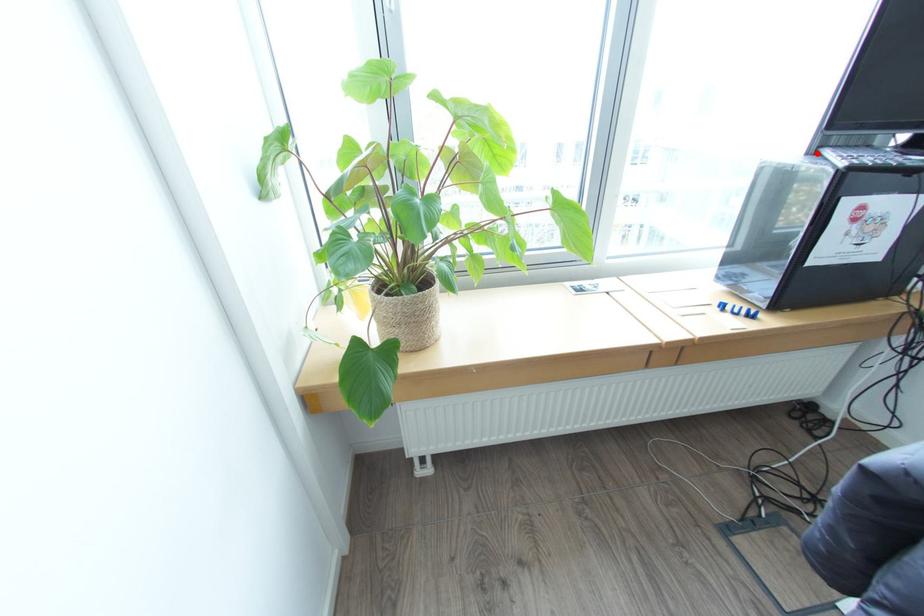
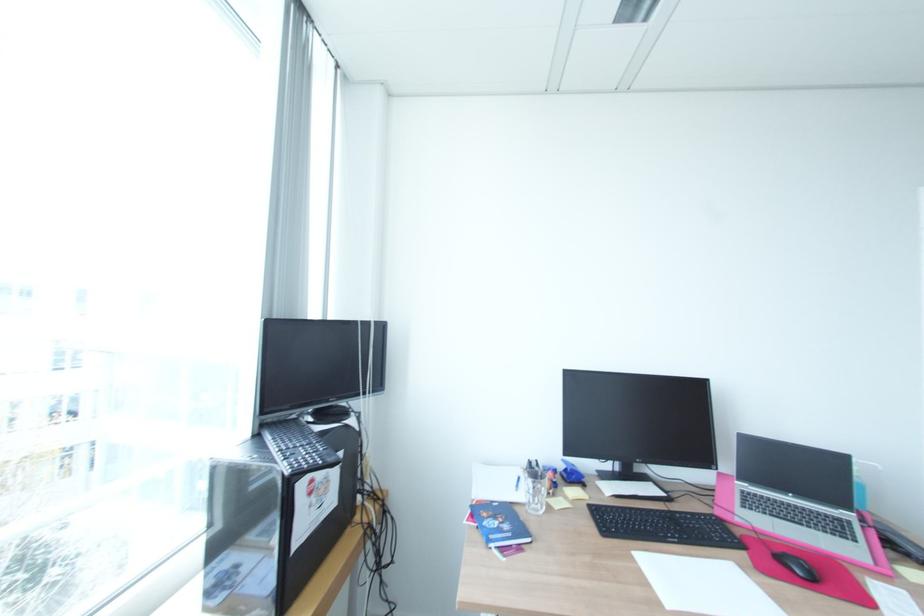
Where in the second image is the point corresponding to the highlighted location from the first image?

(262, 436)